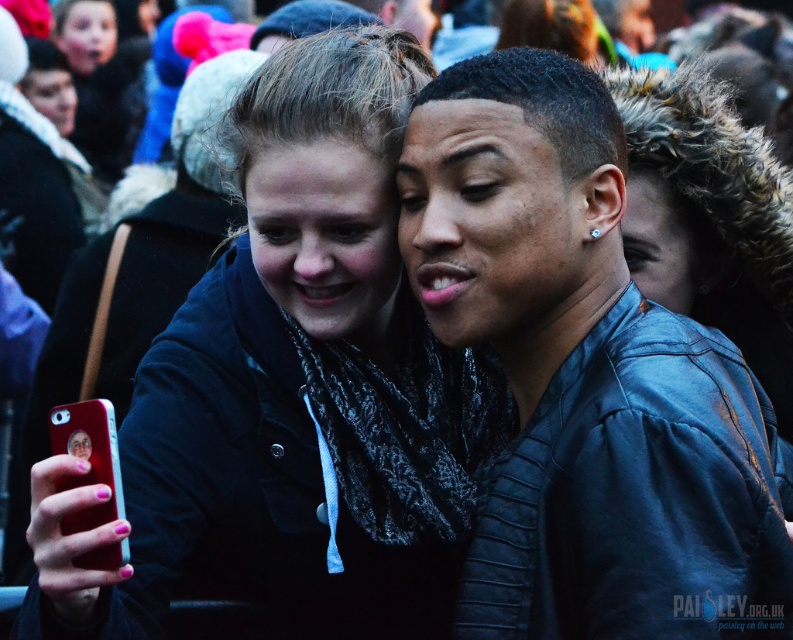
Question: Which object is closer to the camera taking this photo?

Choices:
 (A) leather jacket at center
 (B) matte black jacket at center

Answer: (B)

Question: Which point appears closest to the camera in this image?

Choices:
 (A) (753, 564)
 (B) (378, 115)

Answer: (A)

Question: Can you confirm if matte black jacket at center is smaller than metallic red phone at lower left?

Choices:
 (A) yes
 (B) no

Answer: (B)

Question: Considering the real-world distances, which object is farthest from the metallic red phone at lower left?

Choices:
 (A) leather jacket at center
 (B) matte black jacket at center

Answer: (A)

Question: Observing the image, what is the correct spatial positioning of leather jacket at center in reference to metallic red phone at lower left?

Choices:
 (A) left
 (B) right

Answer: (B)

Question: Does leather jacket at center appear over metallic red phone at lower left?

Choices:
 (A) yes
 (B) no

Answer: (A)